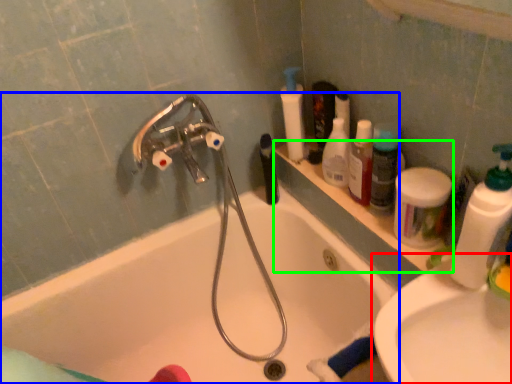
Question: Estimate the real-world distances between objects in this image. Which object is closer to sink (highlighted by a red box), bathtub (highlighted by a blue box) or ledge (highlighted by a green box)?

Choices:
 (A) bathtub
 (B) ledge

Answer: (B)